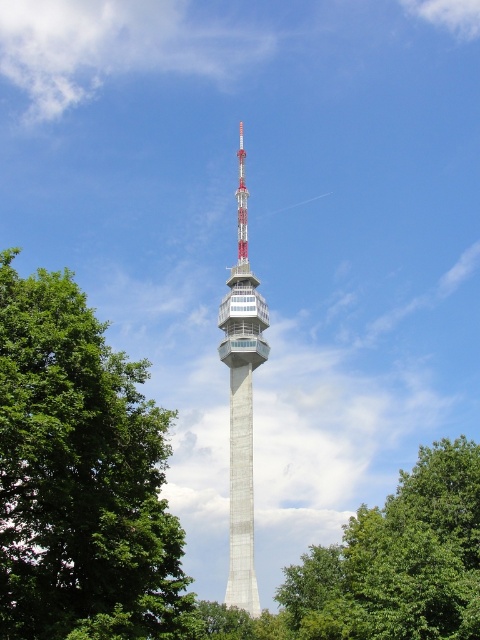
Based on the photo, you are standing in front of the concrete tower at center and want to take a photo of it with the green leafy tree at center in the background. Which direction should you face to ensure the tree is behind the tower in your photo?

You should face to the left of the concrete tower at center because the green leafy tree at center is located to the right of the concrete tower at center. Facing left will position the tree behind the tower in your photo.

You are standing at the base of the tall tower and want to take a photo of the tower with the green leafy tree at left in the background. Based on the tree location, is the tree to your left or right side when facing the tower?

The green leafy tree at left is located at point coordinates that place it to the left side of the tower. When facing the tower, the tree would be to your left side.

You are standing at the base of the concrete tower at center and want to take a photo of the green leafy tree at center. Since the tower is in the way, can you move to the side to get an unobstructed view of the tree?

The green leafy tree at center is located below the concrete tower at center, so you can move to the side to get an unobstructed view of the tree since it is positioned lower than the tower.